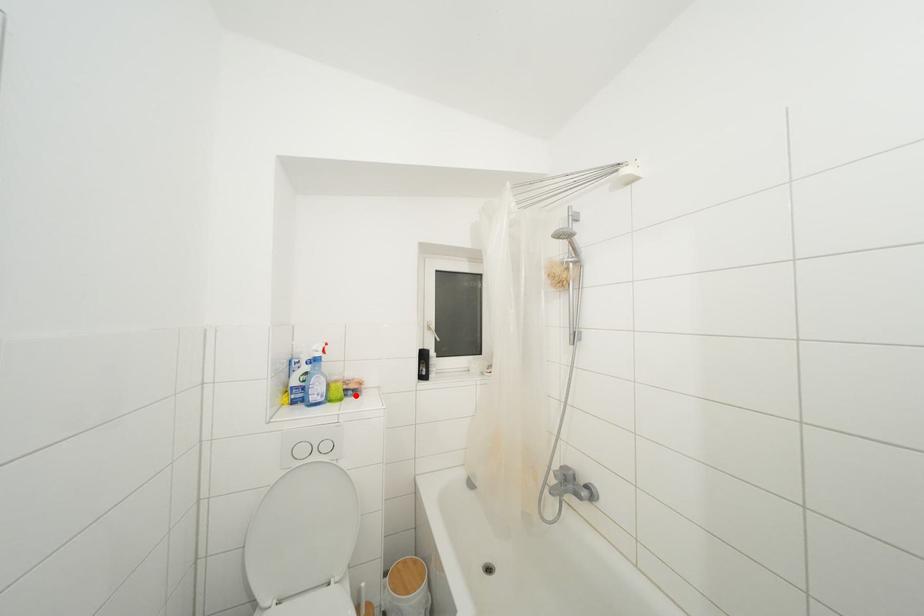
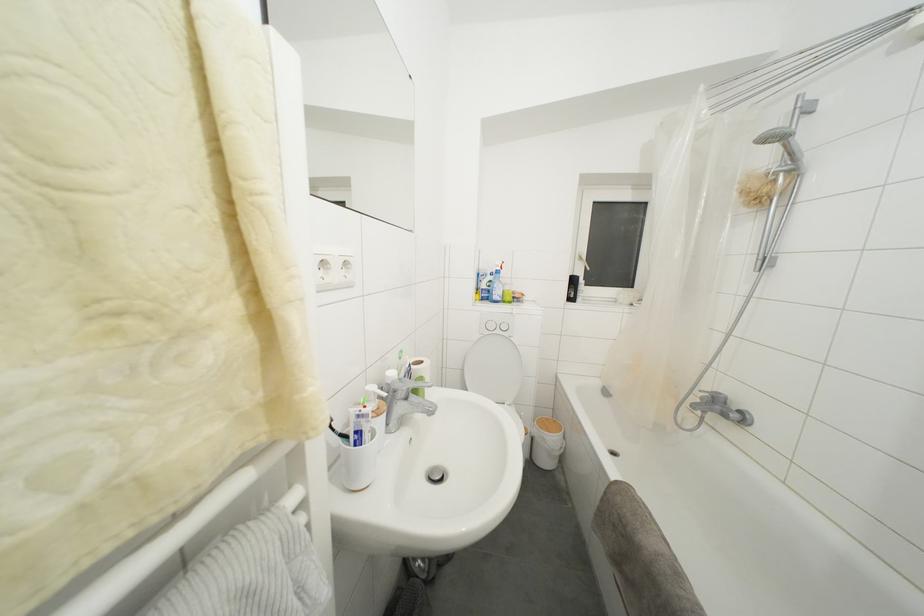
In the second image, find the point that corresponds to the highlighted location in the first image.

(520, 304)